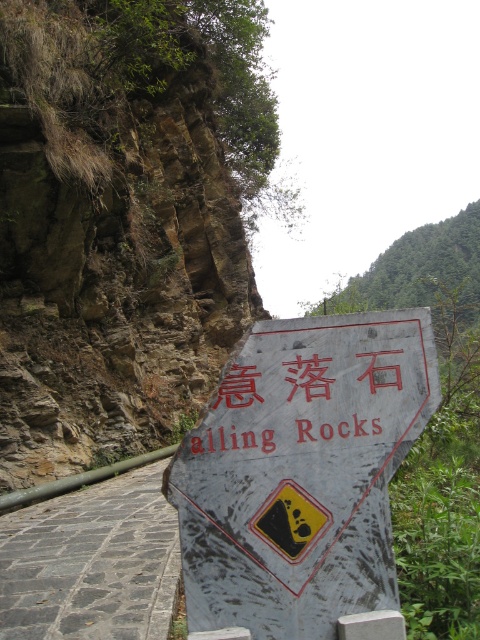
You are a hiker planning to walk along the narrow stone pathway. You see the brown rocky hillside at upper left and the red painted sign at center. The sign warns of falling rocks. If you want to stay as far away as possible from both the hillside and the sign while walking, where should you position yourself on the path?

You should position yourself on the path closer to the middle between the brown rocky hillside at upper left and the red painted sign at center, as this point is equidistant from both and maximizes your distance from both objects.

You are a hiker walking along a narrow stone path and see the weathered gray sign at center and the red painted sign at center. Which sign is located to the right of the other?

The weathered gray sign at center is positioned on the right side of red painted sign at center.